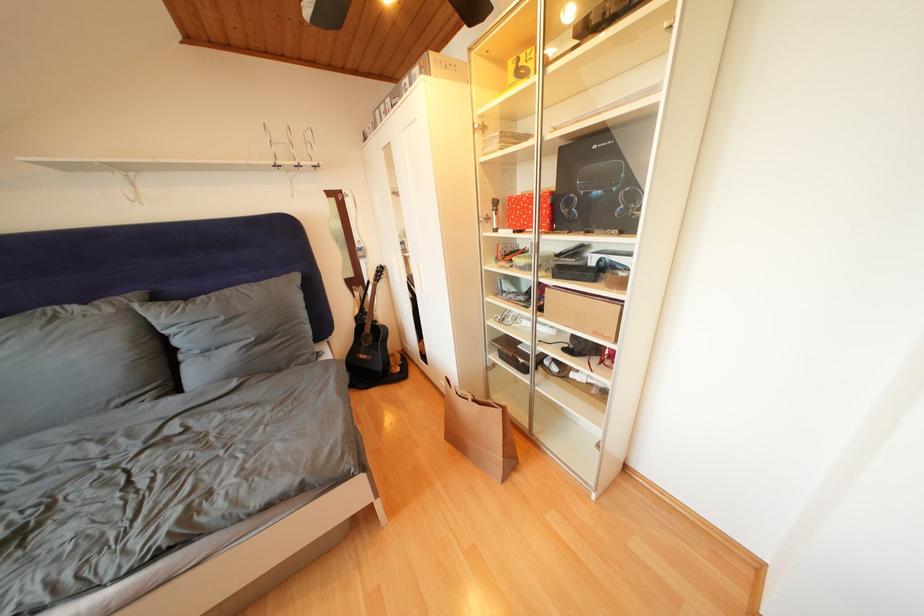
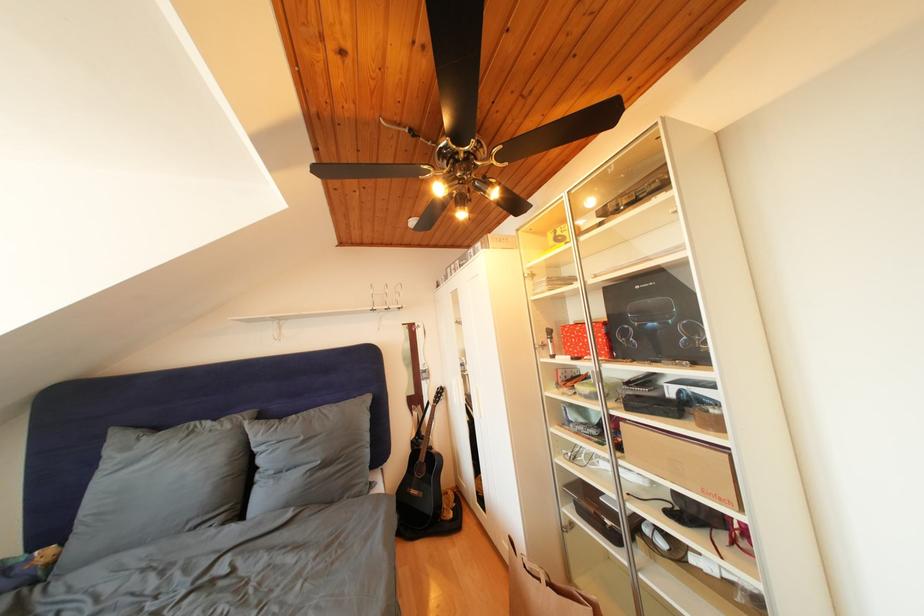
Where in the second image is the point corresponding to [231,323] from the first image?

(310, 444)